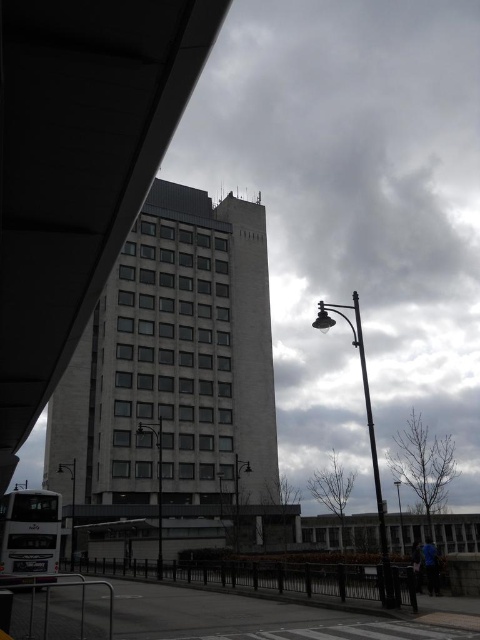
Question: Is the position of white matte/deckbus at lower left more distant than that of metallic gray streetlamp at lower left?

Choices:
 (A) no
 (B) yes

Answer: (A)

Question: Which is farther from the white matte/deckbus at lower left?

Choices:
 (A) metallic gray pole at center
 (B) white concrete building at center
 (C) metallic streetlight at lower right
 (D) satin black pole at center

Answer: (B)

Question: Which point is closer to the camera taking this photo?

Choices:
 (A) (379, 476)
 (B) (399, 481)

Answer: (B)

Question: Is white matte/deckbus at lower left below metallic gray pole at center?

Choices:
 (A) no
 (B) yes

Answer: (A)

Question: Which of the following is the closest to the observer?

Choices:
 (A) (55, 454)
 (B) (26, 544)

Answer: (B)

Question: Is metallic gray streetlamp at lower left positioned before satin black pole at center?

Choices:
 (A) yes
 (B) no

Answer: (B)